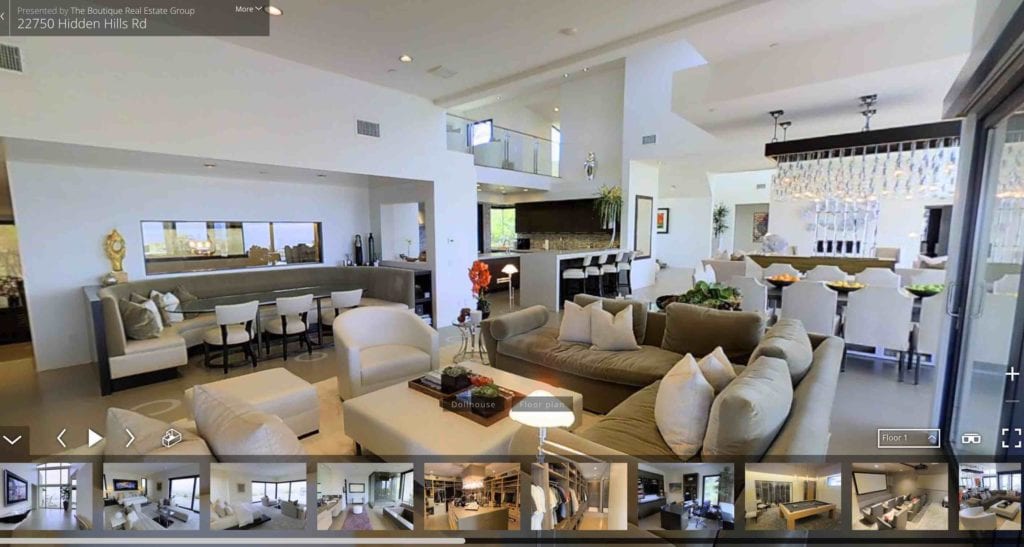
The width and height of the screenshot is (1024, 547). I want to click on kitchen, so click(x=551, y=244).